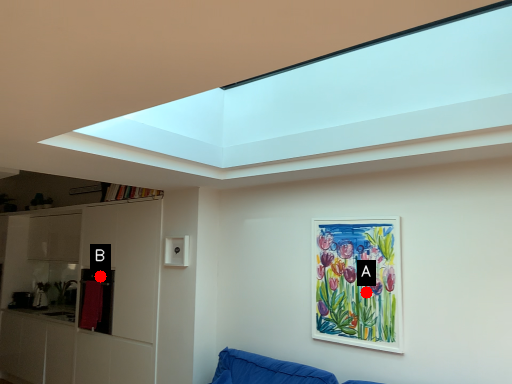
Question: Two points are circled on the image, labeled by A and B beside each circle. Which point is farther to the camera?

Choices:
 (A) A is further
 (B) B is further

Answer: (B)